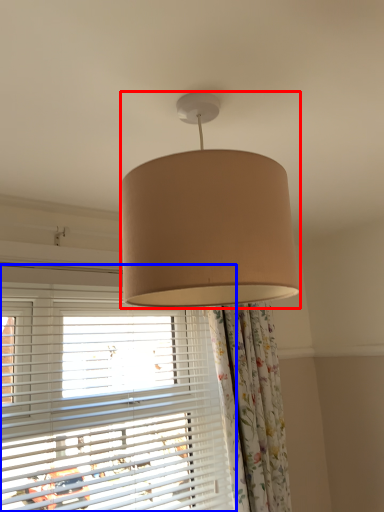
Question: Which point is closer to the camera, lamp (highlighted by a red box) or window (highlighted by a blue box)?

Choices:
 (A) lamp
 (B) window

Answer: (A)